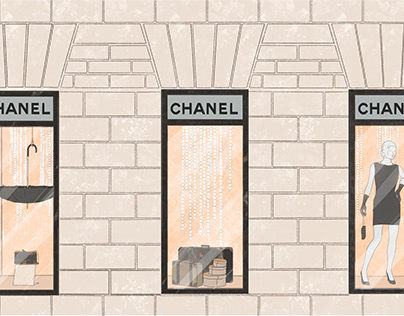
At what (x,y) coordinates should I click in order to perform the action: click on right window. Please return your answer as a coordinate pair (x, y). Looking at the image, I should click on (366, 170).